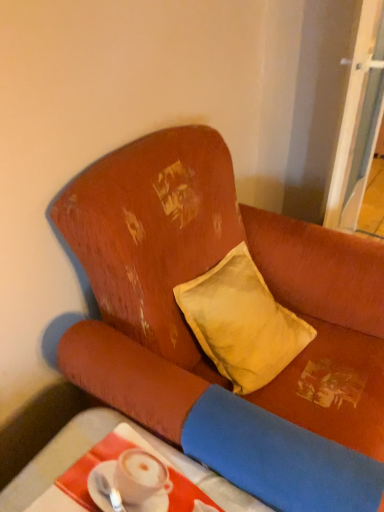
Question: Is white glossy spoon at lower left thinner than transparent glass screen door at upper right?

Choices:
 (A) no
 (B) yes

Answer: (B)

Question: Is white glossy spoon at lower left in front of transparent glass screen door at upper right?

Choices:
 (A) yes
 (B) no

Answer: (A)

Question: Is white glossy spoon at lower left at the left side of transparent glass screen door at upper right?

Choices:
 (A) no
 (B) yes

Answer: (B)

Question: Would you consider white glossy spoon at lower left to be distant from transparent glass screen door at upper right?

Choices:
 (A) no
 (B) yes

Answer: (B)

Question: Could you tell me if white glossy spoon at lower left is facing transparent glass screen door at upper right?

Choices:
 (A) yes
 (B) no

Answer: (B)

Question: From their relative heights in the image, would you say yellow fabric pillow at center is taller or shorter than white glossy spoon at lower left?

Choices:
 (A) tall
 (B) short

Answer: (A)

Question: Looking at their shapes, would you say yellow fabric pillow at center is wider or thinner than white glossy spoon at lower left?

Choices:
 (A) thin
 (B) wide

Answer: (B)

Question: Does point (306, 338) appear closer or farther from the camera than point (115, 501)?

Choices:
 (A) farther
 (B) closer

Answer: (A)

Question: Is yellow fabric pillow at center bigger or smaller than white glossy spoon at lower left?

Choices:
 (A) small
 (B) big

Answer: (B)

Question: Is point (139, 434) positioned closer to the camera than point (379, 49)?

Choices:
 (A) farther
 (B) closer

Answer: (B)

Question: In terms of width, does smooth white table at lower left look wider or thinner when compared to transparent glass screen door at upper right?

Choices:
 (A) thin
 (B) wide

Answer: (B)

Question: In the image, is smooth white table at lower left on the left side or the right side of transparent glass screen door at upper right?

Choices:
 (A) right
 (B) left

Answer: (B)

Question: Considering their positions, is smooth white table at lower left located in front of or behind transparent glass screen door at upper right?

Choices:
 (A) behind
 (B) front

Answer: (B)

Question: Is distressed orange fabric couch at upper left in front of or behind white glossy spoon at lower left in the image?

Choices:
 (A) front
 (B) behind

Answer: (A)

Question: Does point (79, 182) appear closer or farther from the camera than point (122, 510)?

Choices:
 (A) farther
 (B) closer

Answer: (A)